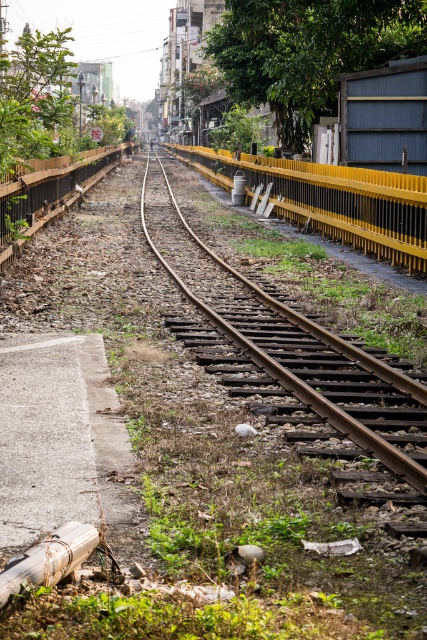
Consider the image. You are a pedestrian trying to cross the railway tracks. You see the rusty metal track at center and the wooden fence at left. Which object is closer to your left side when facing the tracks?

The wooden fence at left is closer to your left side when facing the tracks because the rusty metal track at center is to the right of it.

You are a pedestrian trying to cross the railway tracks. You see the green leafy tree at upper left and the rusty metal track at center. Which object is bigger in size?

The green leafy tree at upper left is larger in size compared to the rusty metal track at center.

You are a pedestrian trying to cross the railway tracks. You notice two green leafy trees in the background. Which tree, the green leafy tree at upper center or the green leafy tree at upper left, would be closer to the tracks?

The green leafy tree at upper center is shorter than the green leafy tree at upper left. Since shorter objects appear closer in perspective, the green leafy tree at upper center is closer to the tracks.